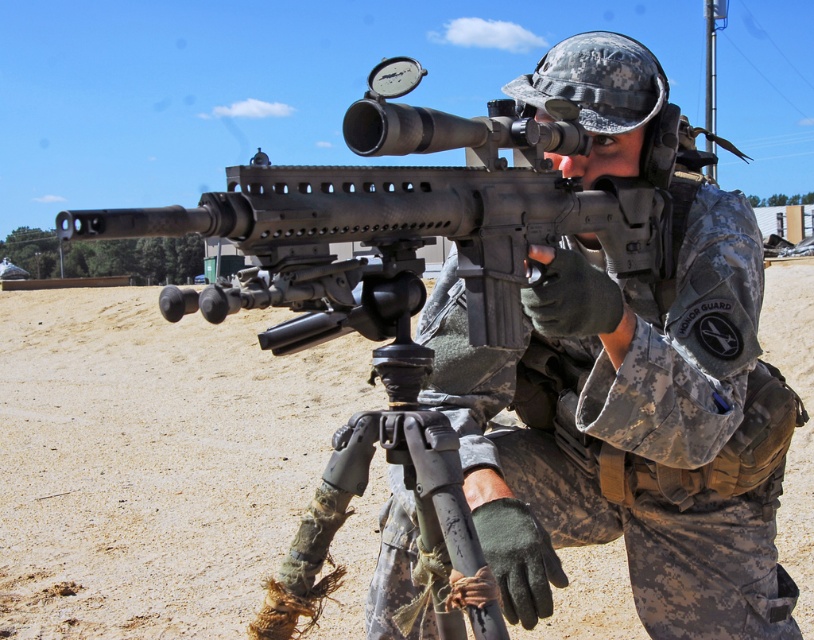
Does point (3, 292) lie in front of point (407, 588)?

No.

Is dirt field at center to the right of camouflage uniform at center from the viewer's perspective?

No, dirt field at center is not to the right of camouflage uniform at center.

Locate an element on the screen. Image resolution: width=814 pixels, height=640 pixels. dirt field at center is located at coordinates (154, 460).

Where is `dirt field at center`? This screenshot has width=814, height=640. dirt field at center is located at coordinates (154, 460).